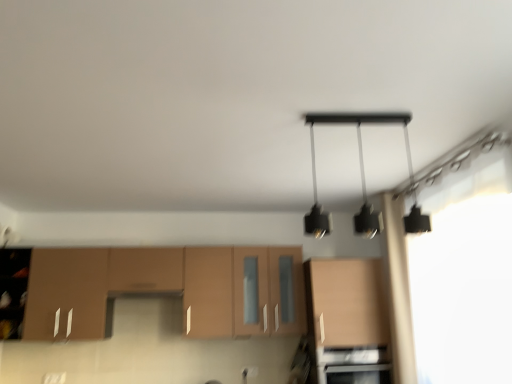
The height and width of the screenshot is (384, 512). What are the coordinates of `black stainless steel oven at lower center` in the screenshot? It's located at (356, 365).

Describe the element at coordinates (360, 167) in the screenshot. I see `black matte pendant light at upper center` at that location.

From the picture: How much space does matte wood cabinetry at lower left, arranged as the 2th cabinetry when viewed from the right, occupy horizontally?

matte wood cabinetry at lower left, arranged as the 2th cabinetry when viewed from the right, is 14.20 inches in width.

Locate an element on the screen. Image resolution: width=512 pixels, height=384 pixels. transparent fabric at upper right is located at coordinates (464, 292).

From the image's perspective, who appears lower, matte wood cabinetry at lower left, arranged as the 2th cabinetry when viewed from the right, or matte wood cabinet at center, the 2th cabinetry from the left?

matte wood cabinet at center, the 2th cabinetry from the left.

Does matte wood cabinetry at lower left, arranged as the 2th cabinetry when viewed from the right, turn towards matte wood cabinet at center, the 1th cabinetry when ordered from right to left?

No, matte wood cabinetry at lower left, arranged as the 2th cabinetry when viewed from the right, is not facing towards matte wood cabinet at center, the 1th cabinetry when ordered from right to left.

In the scene shown: Considering the relative sizes of matte wood cabinetry at lower left, arranged as the 2th cabinetry when viewed from the right, and matte wood cabinet at center, the 1th cabinetry when ordered from right to left, in the image provided, is matte wood cabinetry at lower left, arranged as the 2th cabinetry when viewed from the right, shorter than matte wood cabinet at center, the 1th cabinetry when ordered from right to left,?

No, matte wood cabinetry at lower left, arranged as the 2th cabinetry when viewed from the right, is not shorter than matte wood cabinet at center, the 1th cabinetry when ordered from right to left.

Is matte wood cabinetry at lower left, the 1th cabinetry when ordered from left to right, not within matte wood cabinet at center, the 2th cabinetry from the left?

Yes, matte wood cabinetry at lower left, the 1th cabinetry when ordered from left to right, is outside of matte wood cabinet at center, the 2th cabinetry from the left.

Is black matte pendant light at upper center to the left of matte wood cabinet at center, the 2th cabinetry from the left, from the viewer's perspective?

Indeed, black matte pendant light at upper center is positioned on the left side of matte wood cabinet at center, the 2th cabinetry from the left.

In the scene shown: Is black matte pendant light at upper center in contact with matte wood cabinet at center, the 1th cabinetry when ordered from right to left?

No, black matte pendant light at upper center is not touching matte wood cabinet at center, the 1th cabinetry when ordered from right to left.

How many degrees apart are the facing directions of black matte pendant light at upper center and matte wood cabinet at center, the 2th cabinetry from the left?

The facing directions of black matte pendant light at upper center and matte wood cabinet at center, the 2th cabinetry from the left, are 90.2 degrees apart.

Considering the positions of point (341, 122) and point (378, 315), is point (341, 122) closer or farther from the camera than point (378, 315)?

Point (341, 122) is closer to the camera than point (378, 315).

Which object is further away from the camera taking this photo, black stainless steel oven at lower center or matte wood cabinet at center, the 1th cabinetry when ordered from right to left?

matte wood cabinet at center, the 1th cabinetry when ordered from right to left, is behind.

Consider the image. From the image's perspective, would you say black stainless steel oven at lower center is positioned over matte wood cabinet at center, the 1th cabinetry when ordered from right to left?

No.

Does black stainless steel oven at lower center appear on the left side of matte wood cabinet at center, the 1th cabinetry when ordered from right to left?

No, black stainless steel oven at lower center is not to the left of matte wood cabinet at center, the 1th cabinetry when ordered from right to left.

Is black stainless steel oven at lower center facing towards matte wood cabinet at center, the 1th cabinetry when ordered from right to left?

No, black stainless steel oven at lower center is not oriented towards matte wood cabinet at center, the 1th cabinetry when ordered from right to left.

Can you confirm if matte wood cabinet at center, the 1th cabinetry when ordered from right to left, is wider than black stainless steel oven at lower center?

Yes.

Is matte wood cabinet at center, the 1th cabinetry when ordered from right to left, aimed at black stainless steel oven at lower center?

No, matte wood cabinet at center, the 1th cabinetry when ordered from right to left, is not oriented towards black stainless steel oven at lower center.

Relative to black stainless steel oven at lower center, is matte wood cabinet at center, the 1th cabinetry when ordered from right to left, in front or behind?

matte wood cabinet at center, the 1th cabinetry when ordered from right to left, is behind black stainless steel oven at lower center.

Are matte wood cabinet at center, the 1th cabinetry when ordered from right to left, and black stainless steel oven at lower center far apart?

matte wood cabinet at center, the 1th cabinetry when ordered from right to left, is actually quite close to black stainless steel oven at lower center.

Is matte wood cabinet at center, the 1th cabinetry when ordered from right to left, to the right of black matte pendant light at upper center from the viewer's perspective?

Yes.

Can you confirm if matte wood cabinet at center, the 1th cabinetry when ordered from right to left, is thinner than black matte pendant light at upper center?

No.

In the scene shown: Is matte wood cabinet at center, the 2th cabinetry from the left, facing towards black matte pendant light at upper center?

Yes, matte wood cabinet at center, the 2th cabinetry from the left, is turned towards black matte pendant light at upper center.

Does point (375, 314) appear closer or farther from the camera than point (364, 228)?

Clearly, point (375, 314) is more distant from the camera than point (364, 228).

From a real-world perspective, is black matte pendant light at upper center positioned over matte wood cabinetry at lower left, arranged as the 2th cabinetry when viewed from the right, based on gravity?

Indeed, from a real-world perspective, black matte pendant light at upper center stands above matte wood cabinetry at lower left, arranged as the 2th cabinetry when viewed from the right.

From the image's perspective, between black matte pendant light at upper center and matte wood cabinetry at lower left, the 1th cabinetry when ordered from left to right, which one is located above?

black matte pendant light at upper center.

Is point (369, 221) farther from viewer compared to point (137, 254)?

No, it is not.

Is black matte pendant light at upper center situated inside matte wood cabinetry at lower left, the 1th cabinetry when ordered from left to right, or outside?

black matte pendant light at upper center cannot be found inside matte wood cabinetry at lower left, the 1th cabinetry when ordered from left to right.

Locate an element on the screen. The image size is (512, 384). lamp that is in front of the black stainless steel oven at lower center is located at coordinates (360, 167).

Consider the image. Is black stainless steel oven at lower center positioned with its back to black matte pendant light at upper center?

That's not correct — black stainless steel oven at lower center is not looking away from black matte pendant light at upper center.

In terms of height, does black stainless steel oven at lower center look taller or shorter compared to black matte pendant light at upper center?

black stainless steel oven at lower center is shorter than black matte pendant light at upper center.

Which is closer to the camera, (385,357) or (350,114)?

Point (385,357) is positioned farther from the camera compared to point (350,114).

This screenshot has height=384, width=512. I want to click on cabinetry on the left of matte wood cabinet at center, the 2th cabinetry from the left, so click(168, 289).

Locate an element on the screen. This screenshot has height=384, width=512. cabinetry that is the 2nd one below the black matte pendant light at upper center (from a real-world perspective) is located at coordinates (347, 318).

Which object lies further to the anchor point matte wood cabinetry at lower left, the 1th cabinetry when ordered from left to right, matte wood cabinet at center, the 2th cabinetry from the left, or black matte pendant light at upper center?

Based on the image, black matte pendant light at upper center appears to be further to matte wood cabinetry at lower left, the 1th cabinetry when ordered from left to right.

Based on their spatial positions, is black matte pendant light at upper center or matte wood cabinetry at lower left, arranged as the 2th cabinetry when viewed from the right, further from matte wood cabinet at center, the 1th cabinetry when ordered from right to left?

black matte pendant light at upper center lies further to matte wood cabinet at center, the 1th cabinetry when ordered from right to left, than the other object.

When comparing their distances from black stainless steel oven at lower center, does black matte pendant light at upper center or matte wood cabinetry at lower left, arranged as the 2th cabinetry when viewed from the right, seem closer?

matte wood cabinetry at lower left, arranged as the 2th cabinetry when viewed from the right, is positioned closer to the anchor black stainless steel oven at lower center.

Considering their positions, is black stainless steel oven at lower center positioned further to black matte pendant light at upper center than matte wood cabinetry at lower left, the 1th cabinetry when ordered from left to right?

Among the two, matte wood cabinetry at lower left, the 1th cabinetry when ordered from left to right, is located further to black matte pendant light at upper center.

Consider the image. Estimate the real-world distances between objects in this image. Which object is further from black stainless steel oven at lower center, matte wood cabinetry at lower left, arranged as the 2th cabinetry when viewed from the right, or black matte pendant light at upper center?

The object further to black stainless steel oven at lower center is black matte pendant light at upper center.

When comparing their distances from transparent fabric at upper right, does matte wood cabinetry at lower left, arranged as the 2th cabinetry when viewed from the right, or black matte pendant light at upper center seem further?

Based on the image, matte wood cabinetry at lower left, arranged as the 2th cabinetry when viewed from the right, appears to be further to transparent fabric at upper right.

Which object lies further to the anchor point matte wood cabinetry at lower left, the 1th cabinetry when ordered from left to right, black stainless steel oven at lower center or matte wood cabinet at center, the 2th cabinetry from the left?

The object further to matte wood cabinetry at lower left, the 1th cabinetry when ordered from left to right, is black stainless steel oven at lower center.

From the image, which object appears to be farther from matte wood cabinet at center, the 2th cabinetry from the left, black stainless steel oven at lower center or transparent fabric at upper right?

Based on the image, transparent fabric at upper right appears to be further to matte wood cabinet at center, the 2th cabinetry from the left.

Locate an element on the screen. This screenshot has width=512, height=384. lamp between matte wood cabinetry at lower left, the 1th cabinetry when ordered from left to right, and black stainless steel oven at lower center is located at coordinates (360, 167).

Locate an element on the screen. lamp between matte wood cabinetry at lower left, arranged as the 2th cabinetry when viewed from the right, and transparent fabric at upper right from left to right is located at coordinates (360, 167).

This screenshot has height=384, width=512. Find the location of `cabinetry between matte wood cabinetry at lower left, the 1th cabinetry when ordered from left to right, and transparent fabric at upper right from left to right`. cabinetry between matte wood cabinetry at lower left, the 1th cabinetry when ordered from left to right, and transparent fabric at upper right from left to right is located at coordinates (347, 318).

Find the location of a particular element. The width and height of the screenshot is (512, 384). oven positioned between transparent fabric at upper right and matte wood cabinet at center, the 2th cabinetry from the left, from near to far is located at coordinates (356, 365).